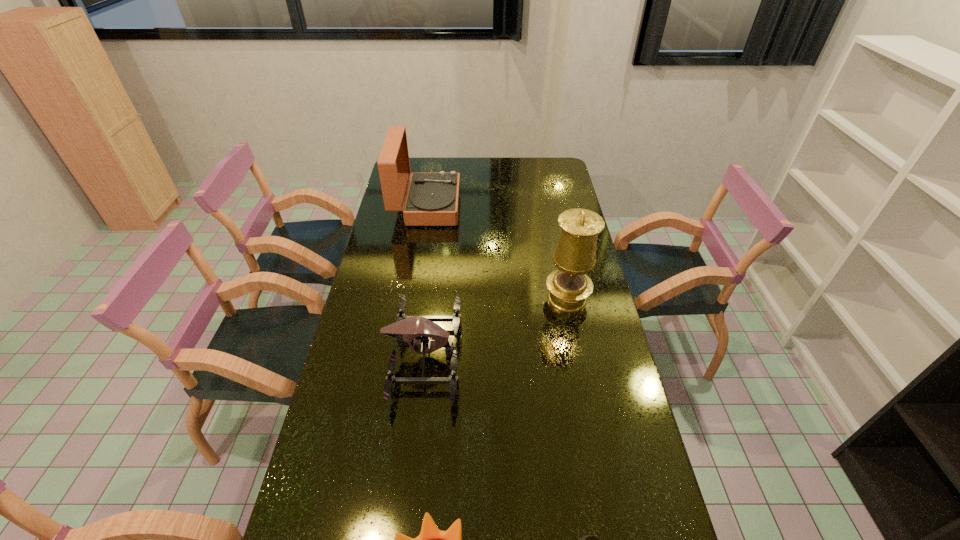
The image size is (960, 540). In order to click on free space at the far edge of the desktop in this screenshot , I will do `click(498, 173)`.

This screenshot has width=960, height=540. What are the coordinates of `free space at the left edge of the desktop` in the screenshot? It's located at (390, 261).

The height and width of the screenshot is (540, 960). What are the coordinates of `free space at the right edge of the desktop` in the screenshot? It's located at (557, 269).

Locate an element on the screen. The height and width of the screenshot is (540, 960). free space at the far right corner of the desktop is located at coordinates (534, 160).

Find the location of a particular element. The width and height of the screenshot is (960, 540). vacant area that lies between the tallest object and the drone is located at coordinates (495, 327).

At what (x,y) coordinates should I click in order to perform the action: click on free point between the farthest object and the drone. Please return your answer as a coordinate pair (x, y). The height and width of the screenshot is (540, 960). Looking at the image, I should click on (425, 281).

In order to click on unoccupied position between the drone and the tallest object in this screenshot , I will do `click(495, 327)`.

The image size is (960, 540). Identify the location of vacant space in between the phonograph record and the oil lamp. tap(497, 252).

Where is `object identified as the second closest to the drone`? This screenshot has width=960, height=540. object identified as the second closest to the drone is located at coordinates (569, 287).

Identify the location of object that is the closest one to the wineglass. (431, 539).